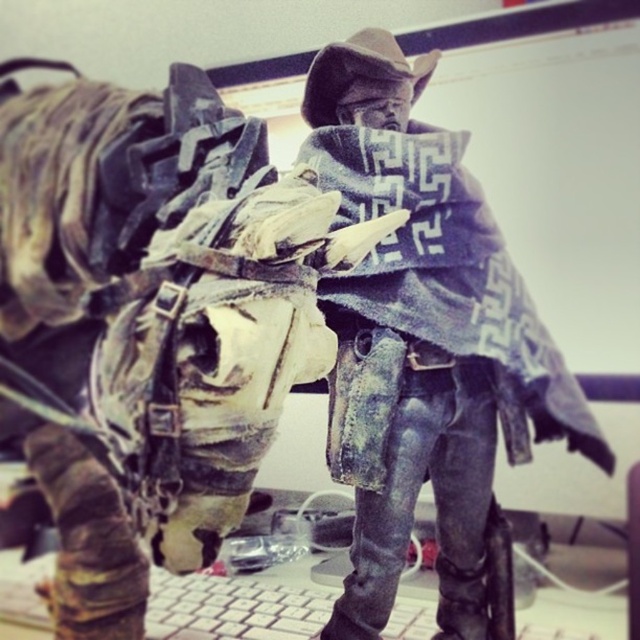
You are organizing a western themed display and need to ensure the jackets are arranged properly. According to the image, which jacket is closer to the viewer between the worn leather jacket at center and the worn denim jacket at center?

The worn leather jacket at center is closer to the viewer because it is in front of the worn denim jacket at center.

You are a photographer who needs to capture a closeup shot of the worn leather jacket at center. The camera you are using has a minimum focusing distance of 20 inches. Can you take the photo without moving either the camera or the jacket?

The worn leather jacket at center and camera are 21.59 inches apart, which is beyond the camera minimum focusing distance of 20 inches. Therefore, you can take the photo without moving either the camera or the jacket.

You are an action figure collector examining the two points on your desk. The first point is labeled as point [136,244] and the second is point [468,259]. If you want to place a small sticker between them, which point should you place it closer to to ensure it is in front of both points?

To place the sticker between the two points while keeping it in front of both, position it closer to point [136,244] since it is already in front of point [468,259].